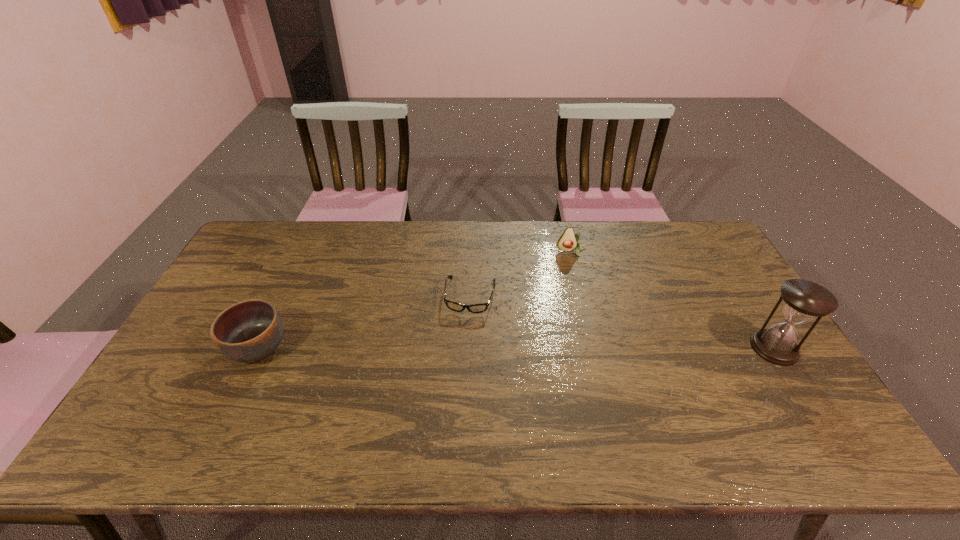
In order to click on free point located 0.120m on the front-facing side of the shortest object in this screenshot , I will do `click(462, 347)`.

Locate an element on the screen. free space located on the front-facing side of the shortest object is located at coordinates click(x=459, y=365).

Where is `free spot located on the seed side of the avocado`? free spot located on the seed side of the avocado is located at coordinates (576, 274).

Find the location of a particular element. This screenshot has height=540, width=960. vacant space located 0.350m on the seed side of the avocado is located at coordinates (588, 334).

You are a GUI agent. You are given a task and a screenshot of the screen. Output one action in this format:
    pyautogui.click(x=<x>, y=<y>)
    Task: Click on the vacant area situated 0.290m on the seed side of the avocado
    This screenshot has width=960, height=540.
    Given the screenshot: What is the action you would take?
    pyautogui.click(x=586, y=319)

The width and height of the screenshot is (960, 540). I want to click on object located in the far edge section of the desktop, so click(568, 241).

I want to click on object that is at the left edge, so click(248, 331).

I want to click on object present at the right edge, so click(804, 300).

Image resolution: width=960 pixels, height=540 pixels. In order to click on vacant space at the far edge of the desktop in this screenshot , I will do `click(407, 247)`.

Image resolution: width=960 pixels, height=540 pixels. Find the location of `vacant space at the near edge of the desktop`. vacant space at the near edge of the desktop is located at coordinates (482, 408).